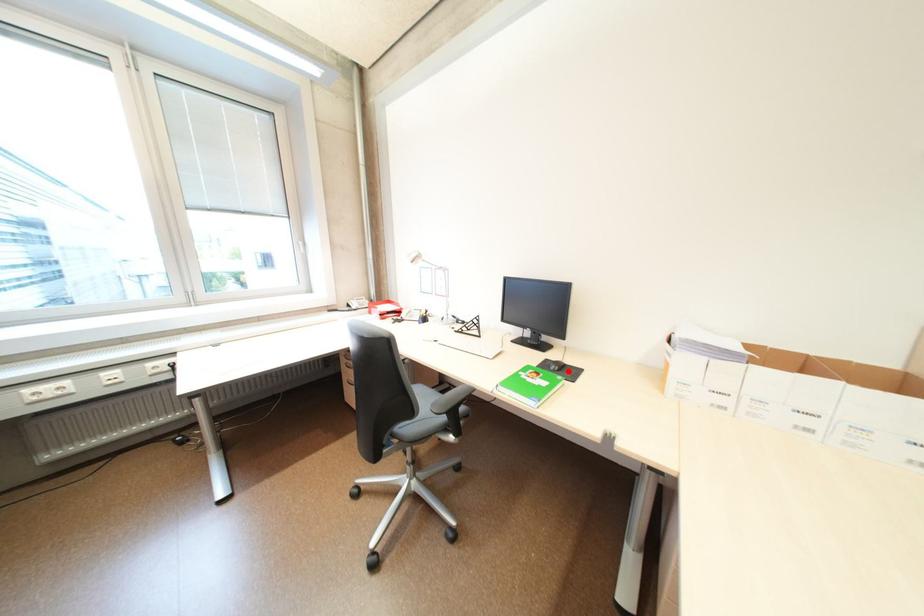
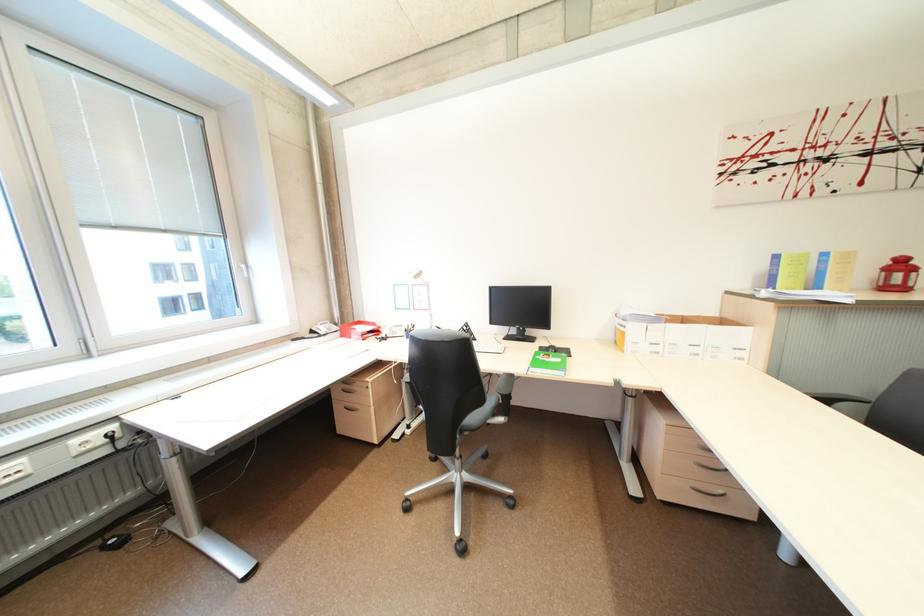
Find the pixel in the second image that matches the highlighted location in the first image.

(565, 353)